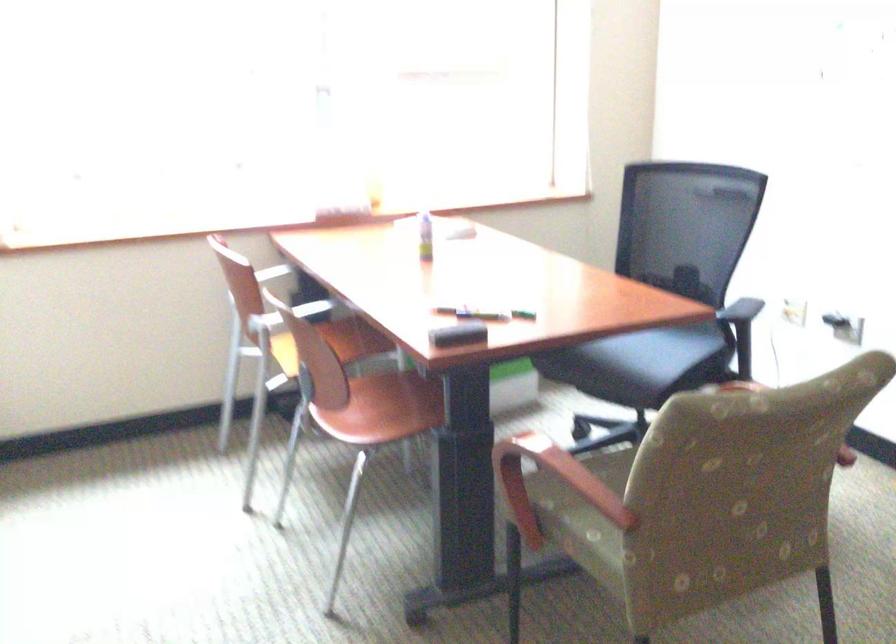
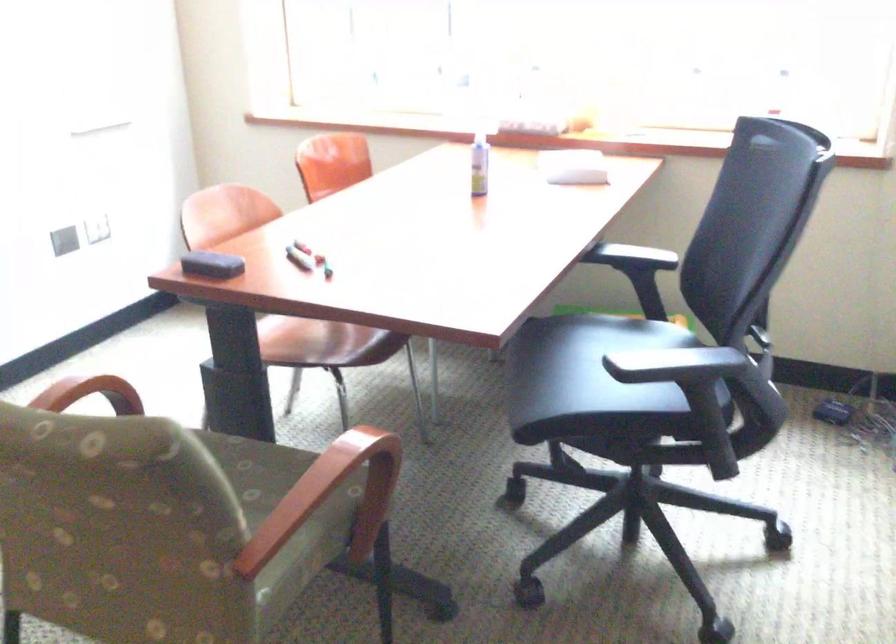
The point at (x=359, y=419) is marked in the first image. Where is the corresponding point in the second image?

(295, 336)